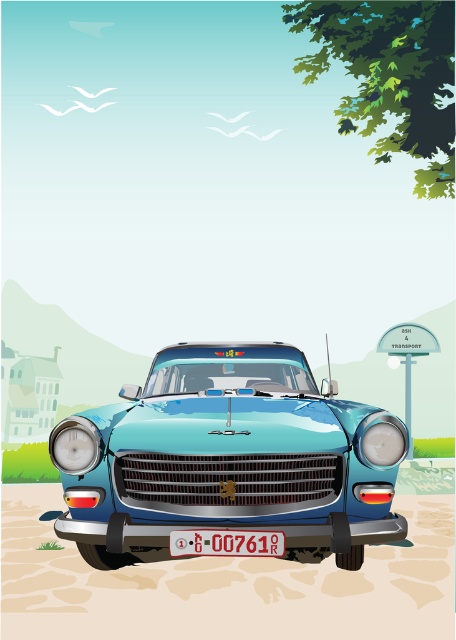
Who is lower down, green leafy tree at upper right or white plastic license plate at center?

white plastic license plate at center

Is point (418, 29) positioned in front of point (198, 552)?

No.

Find the location of a particular element. The width and height of the screenshot is (456, 640). green leafy tree at upper right is located at coordinates (389, 76).

Can you confirm if glossy metallic car at center is positioned below green leafy tree at upper right?

Yes, glossy metallic car at center is below green leafy tree at upper right.

Who is higher up, glossy metallic car at center or green leafy tree at upper right?

green leafy tree at upper right is higher up.

Is point (166, 376) more distant than point (399, 13)?

No.

The image size is (456, 640). Find the location of `glossy metallic car at center`. glossy metallic car at center is located at coordinates (228, 458).

Is glossy metallic car at center positioned in front of white plastic license plate at center?

No.

Between point (283, 426) and point (217, 529), which one is positioned in front?

Point (217, 529)

Where is `glossy metallic car at center`? The image size is (456, 640). glossy metallic car at center is located at coordinates (228, 458).